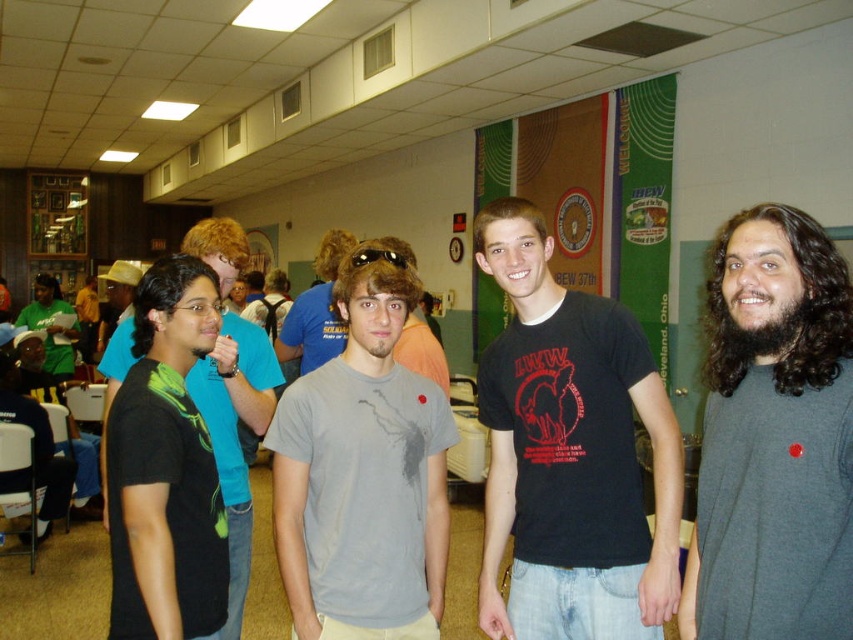
Does black matte t-shirt at center have a lesser width compared to gray cotton t-shirt at center?

No, black matte t-shirt at center is not thinner than gray cotton t-shirt at center.

Based on the photo, between black matte t-shirt at center and gray cotton t-shirt at center, which one has more height?

black matte t-shirt at center

Locate an element on the screen. The image size is (853, 640). black matte t-shirt at center is located at coordinates (570, 452).

This screenshot has width=853, height=640. What do you see at coordinates (363, 467) in the screenshot?
I see `gray matte t-shirt at center` at bounding box center [363, 467].

Does gray matte t-shirt at center have a lesser width compared to gray cotton t-shirt at center?

No, gray matte t-shirt at center is not thinner than gray cotton t-shirt at center.

What do you see at coordinates (363, 467) in the screenshot?
I see `gray matte t-shirt at center` at bounding box center [363, 467].

You are a GUI agent. You are given a task and a screenshot of the screen. Output one action in this format:
    pyautogui.click(x=<x>, y=<y>)
    Task: Click on the gray matte t-shirt at center
    The height and width of the screenshot is (640, 853).
    Given the screenshot: What is the action you would take?
    pyautogui.click(x=363, y=467)

Can you confirm if gray matte t-shirt at center is positioned to the right of matte green shirt at left?

Correct, you'll find gray matte t-shirt at center to the right of matte green shirt at left.

Where is `gray matte t-shirt at center`? gray matte t-shirt at center is located at coordinates (363, 467).

I want to click on gray matte t-shirt at center, so click(363, 467).